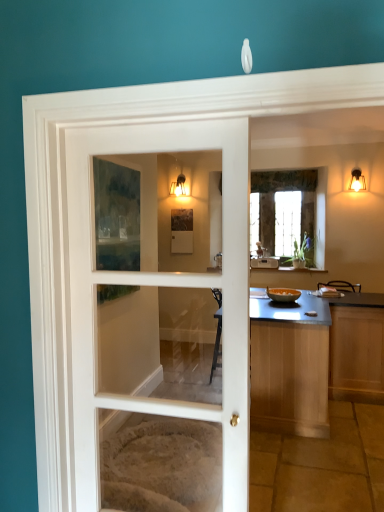
Question: From a real-world perspective, is matte glass sconce at upper center, arranged as the 1th light fixture when viewed from the back, above or below smooth wooden countertop at center?

Choices:
 (A) above
 (B) below

Answer: (A)

Question: From the image's perspective, is matte glass sconce at upper center, which is the second light fixture in right-to-left order, located above or below smooth wooden countertop at center?

Choices:
 (A) below
 (B) above

Answer: (B)

Question: Which of these objects is positioned farthest from the smooth wooden countertop at center?

Choices:
 (A) matte glass sconce at upper center, acting as the 2th light fixture starting from the front
 (B) clear glass window at center
 (C) white glass door at center
 (D) matte gold light fixture at upper right, the 2th light fixture in the back-to-front sequence

Answer: (A)

Question: Based on their relative distances, which object is farther from the clear glass window at center?

Choices:
 (A) matte gold light fixture at upper right, the 1th light fixture viewed from the right
 (B) white glass door at center
 (C) smooth wooden countertop at center
 (D) matte glass sconce at upper center, the 1th light fixture in the left-to-right sequence

Answer: (B)